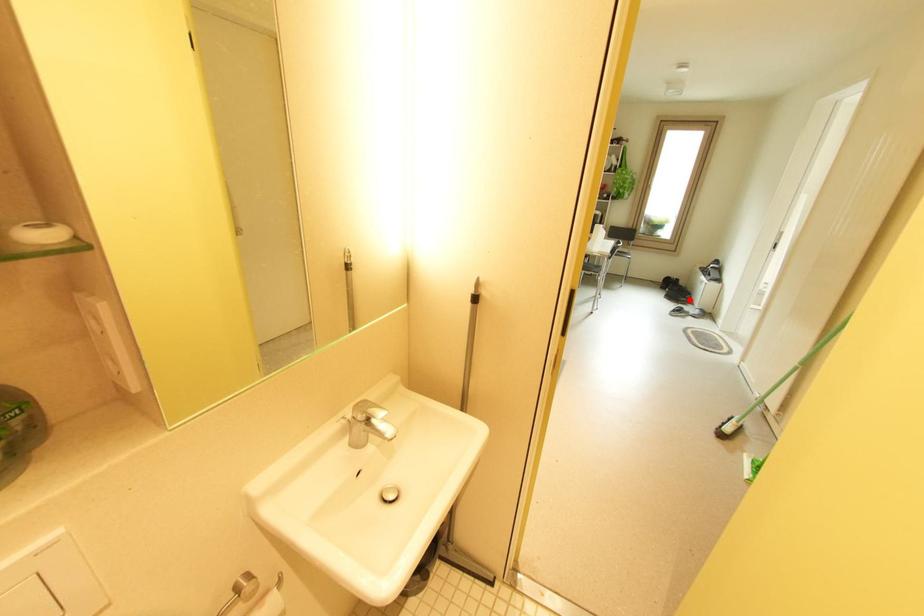
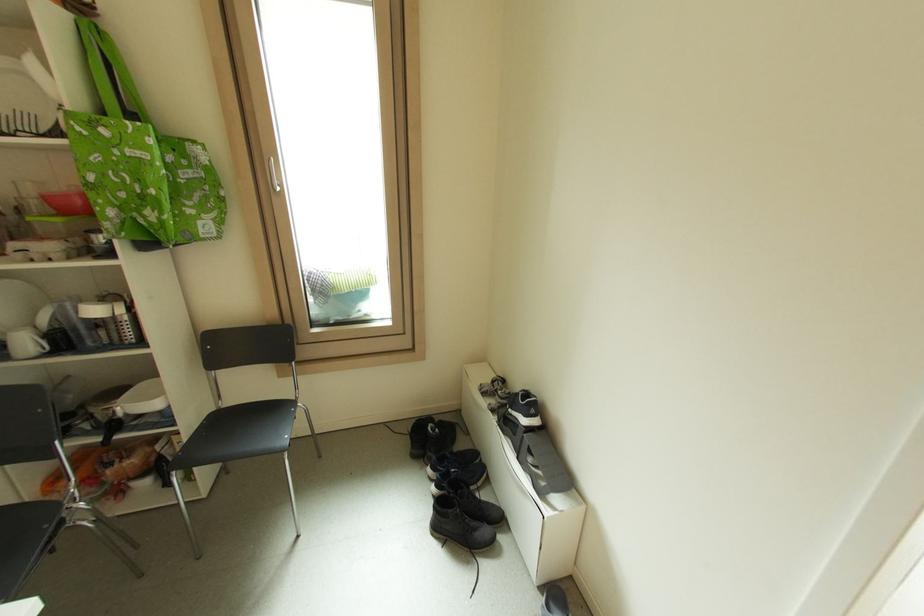
Question: A red point is marked in image1. In image2, is the corresponding 3D point closer to the camera or farther? Reply with the corresponding letter.

Choices:
 (A) The corresponding 3D point is closer.
 (B) The corresponding 3D point is farther.

Answer: (B)